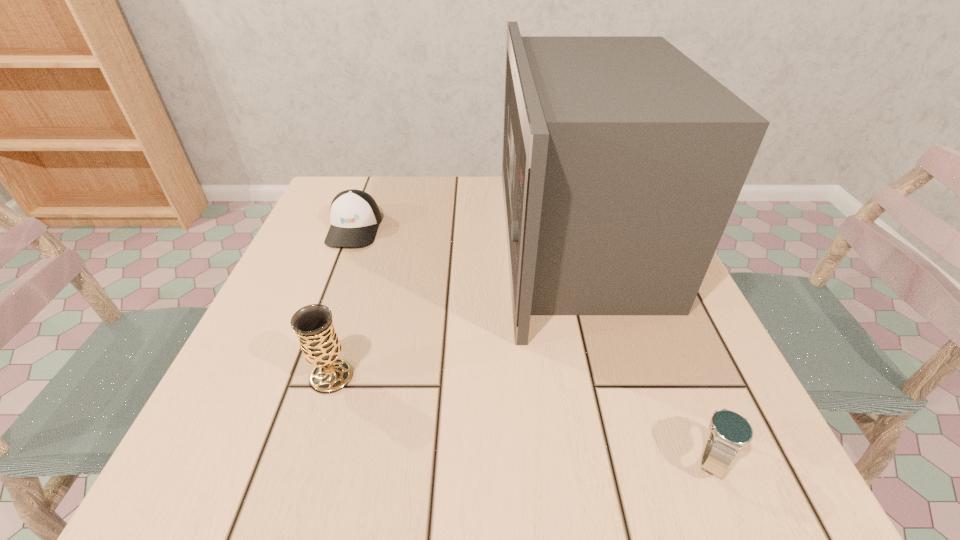
You are a GUI agent. You are given a task and a screenshot of the screen. Output one action in this format:
    pyautogui.click(x=<x>, y=<y>)
    Task: Click on the object present at the near right corner
    This screenshot has height=540, width=960.
    Given the screenshot: What is the action you would take?
    pyautogui.click(x=730, y=431)

Locate an element on the screen. The width and height of the screenshot is (960, 540). blank area at the far edge is located at coordinates (417, 183).

This screenshot has height=540, width=960. What are the coordinates of `free space at the near edge of the desktop` in the screenshot? It's located at (372, 429).

This screenshot has width=960, height=540. In the image, there is a desktop. What are the coordinates of `vacant space at the left edge` in the screenshot? It's located at (301, 242).

Identify the location of vacant space at the far left corner of the desktop. The image size is (960, 540). (370, 177).

In the image, there is a desktop. Where is `vacant space at the near left corner`? The height and width of the screenshot is (540, 960). vacant space at the near left corner is located at coordinates (210, 435).

Where is `vacant space at the near right corner of the desktop`? vacant space at the near right corner of the desktop is located at coordinates (663, 433).

In order to click on vacant space that's between the second nearest object and the watch in this screenshot , I will do `click(522, 417)`.

What are the coordinates of `free spot between the nearest object and the chalice` in the screenshot? It's located at (522, 417).

Image resolution: width=960 pixels, height=540 pixels. What are the coordinates of `empty location between the nearest object and the chalice` in the screenshot? It's located at (522, 417).